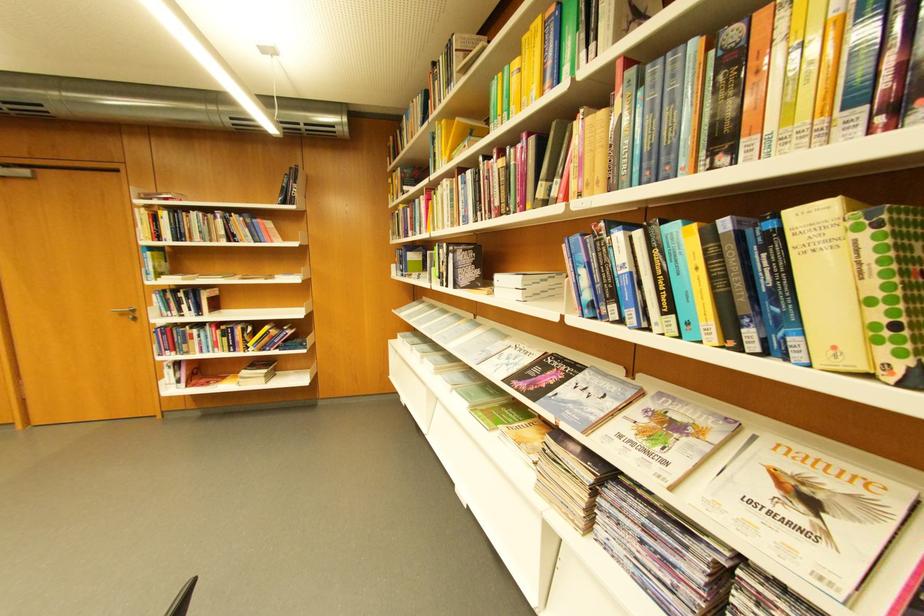
The width and height of the screenshot is (924, 616). In order to click on white paper box in this screenshot , I will do `click(528, 285)`.